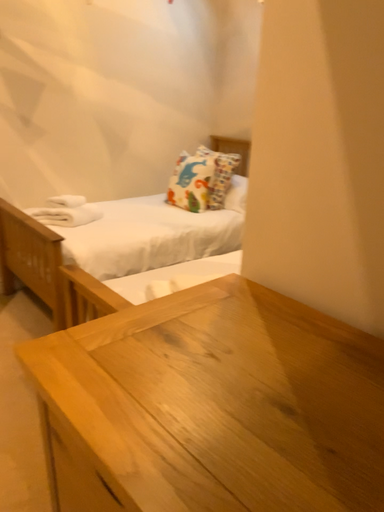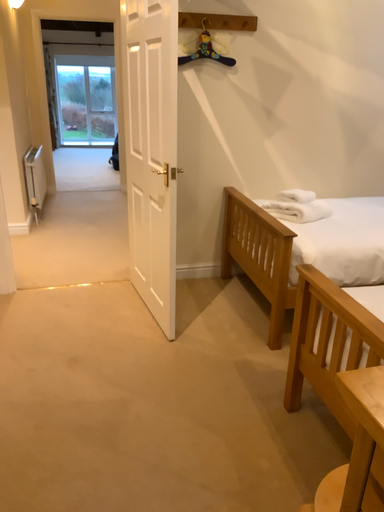
Question: Which way did the camera rotate in the video?

Choices:
 (A) rotated left
 (B) rotated right

Answer: (A)